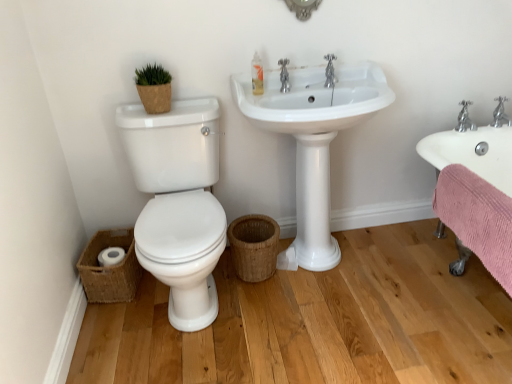
Locate an element on the screen. free area below white glossy sink at center, the first sink positioned from the left (from a real-world perspective) is located at coordinates (332, 269).